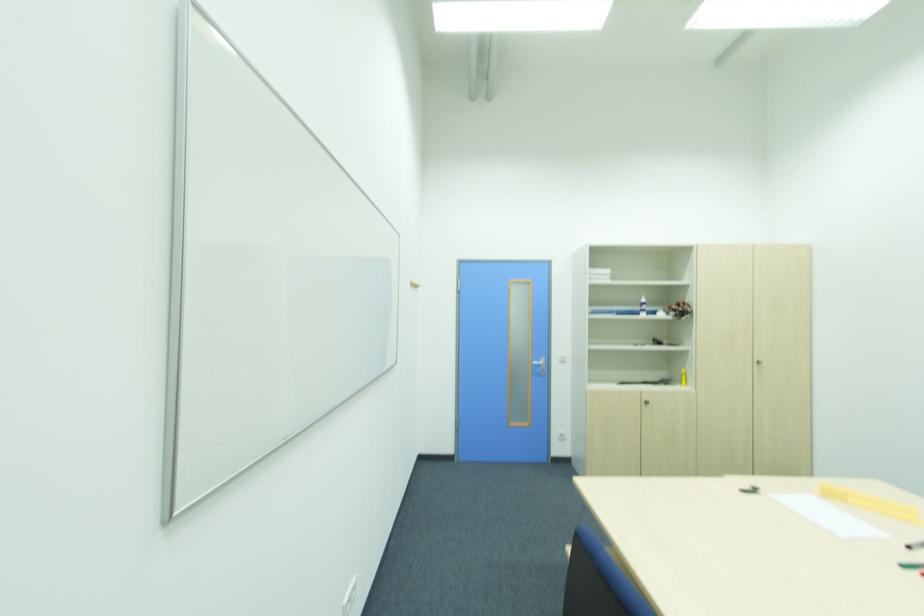
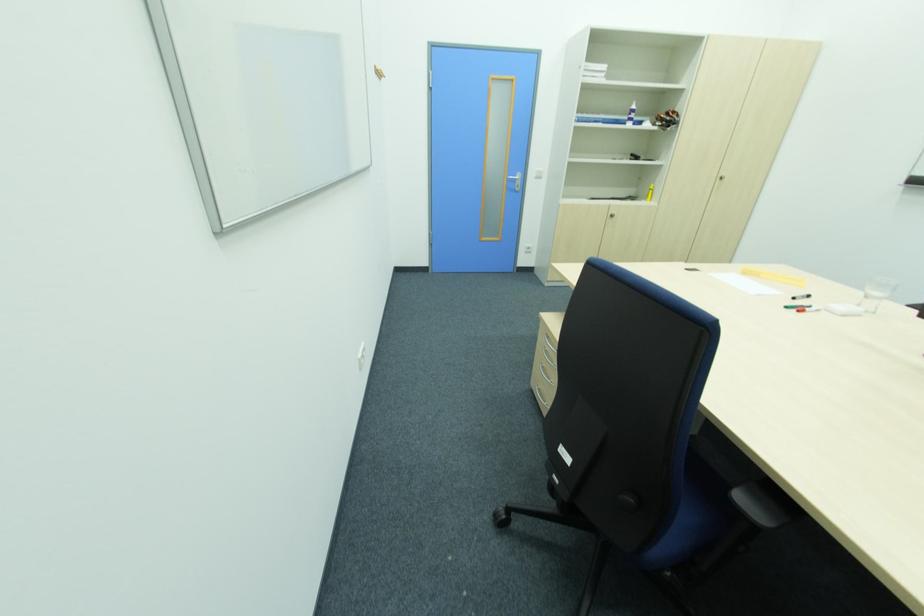
Question: Which direction would the cameraman need to move to produce the second image? Reply with the corresponding letter.

Choices:
 (A) Left
 (B) Right
 (C) Forward
 (D) Backward

Answer: (A)